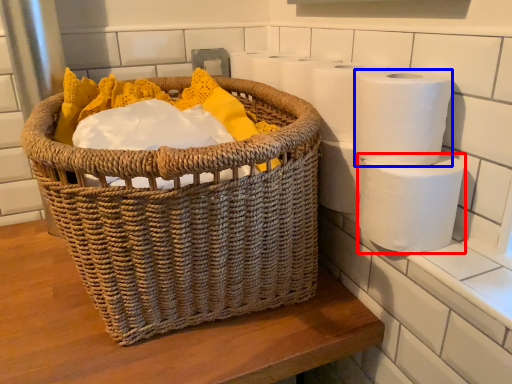
Question: Which object is further to the camera taking this photo, toilet paper (highlighted by a red box) or toilet paper (highlighted by a blue box)?

Choices:
 (A) toilet paper
 (B) toilet paper

Answer: (A)